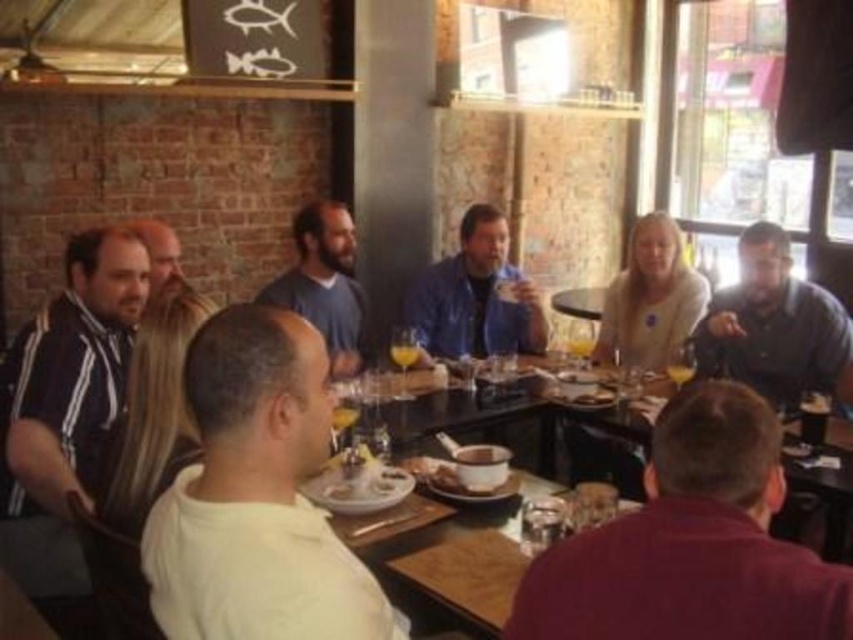
Question: Which point appears closest to the camera in this image?

Choices:
 (A) 532,348
 (B) 515,557

Answer: (B)

Question: Which of these objects is positioned closest to the striped jersey at left?

Choices:
 (A) wooden table at center
 (B) dark blue shirt at right
 (C) dark blue sweater at center

Answer: (A)

Question: Can you confirm if dark blue shirt at right is positioned to the right of wooden table at center?

Choices:
 (A) yes
 (B) no

Answer: (A)

Question: Which of the following is the closest to the observer?

Choices:
 (A) wooden table at center
 (B) bearded man at left
 (C) blue denim jacket at center

Answer: (A)

Question: Is maroon sweater at lower right thinner than striped jersey at left?

Choices:
 (A) no
 (B) yes

Answer: (B)

Question: Is maroon sweater at lower right closer to the viewer compared to bearded man at left?

Choices:
 (A) yes
 (B) no

Answer: (A)